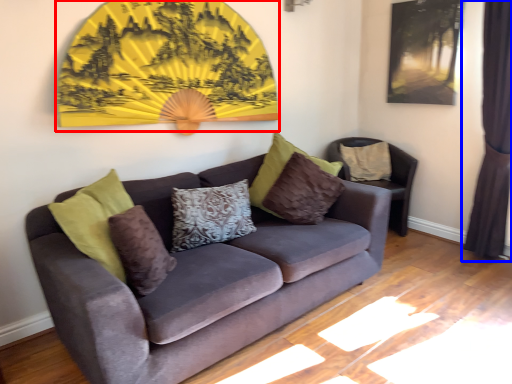
Question: Which object appears farthest to the camera in this image, decor (highlighted by a red box) or curtain (highlighted by a blue box)?

Choices:
 (A) decor
 (B) curtain

Answer: (B)